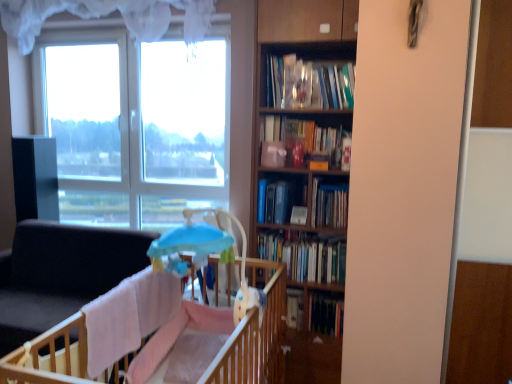
Question: Is the position of wooden bookcase at center more distant than that of light blue plastic baby carriage at center?

Choices:
 (A) no
 (B) yes

Answer: (B)

Question: Considering the relative positions of wooden bookcase at center and light blue plastic baby carriage at center in the image provided, is wooden bookcase at center to the right of light blue plastic baby carriage at center from the viewer's perspective?

Choices:
 (A) no
 (B) yes

Answer: (B)

Question: From the image's perspective, would you say wooden bookcase at center is shown under light blue plastic baby carriage at center?

Choices:
 (A) yes
 (B) no

Answer: (B)

Question: Is wooden bookcase at center bigger than light blue plastic baby carriage at center?

Choices:
 (A) yes
 (B) no

Answer: (A)

Question: Can you confirm if wooden bookcase at center is shorter than light blue plastic baby carriage at center?

Choices:
 (A) yes
 (B) no

Answer: (B)

Question: Does point (199, 69) appear closer or farther from the camera than point (310, 329)?

Choices:
 (A) closer
 (B) farther

Answer: (B)

Question: In terms of width, does transparent glass window at upper left look wider or thinner when compared to hardcover book at center, the 5th book viewed from the top?

Choices:
 (A) wide
 (B) thin

Answer: (A)

Question: From a real-world perspective, is transparent glass window at upper left physically located above or below hardcover book at center, the 5th book viewed from the top?

Choices:
 (A) above
 (B) below

Answer: (A)

Question: From the image's perspective, is transparent glass window at upper left positioned above or below hardcover book at center, the 5th book viewed from the top?

Choices:
 (A) above
 (B) below

Answer: (A)

Question: From the image's perspective, is hardcover book at center, which appears as the 1th book when ordered from the bottom, above or below light blue plastic baby carriage at center?

Choices:
 (A) below
 (B) above

Answer: (A)

Question: Is hardcover book at center, the 5th book viewed from the top, spatially inside light blue plastic baby carriage at center, or outside of it?

Choices:
 (A) inside
 (B) outside

Answer: (B)

Question: Looking at the image, does hardcover book at center, which appears as the 1th book when ordered from the bottom, seem bigger or smaller compared to light blue plastic baby carriage at center?

Choices:
 (A) big
 (B) small

Answer: (B)

Question: Is point (321, 301) closer or farther from the camera than point (230, 251)?

Choices:
 (A) farther
 (B) closer

Answer: (A)

Question: In the image, is hardcover book at center, which appears as the 2th book when ordered from the bottom, positioned in front of or behind hardcover book at center, the 5th book viewed from the top?

Choices:
 (A) behind
 (B) front

Answer: (A)

Question: Considering the positions of hardcover book at center, which is counted as the 4th book, starting from the top, and hardcover book at center, the 5th book viewed from the top, in the image, is hardcover book at center, which is counted as the 4th book, starting from the top, wider or thinner than hardcover book at center, the 5th book viewed from the top,?

Choices:
 (A) wide
 (B) thin

Answer: (A)